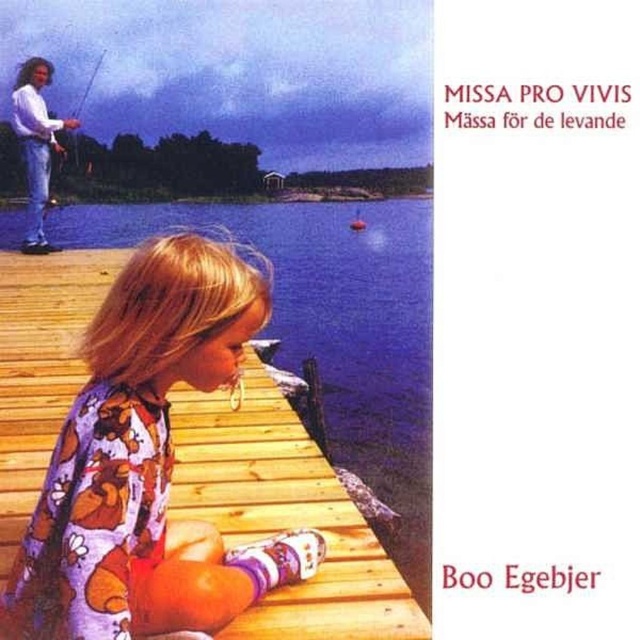
Question: Is purple printed dress at center positioned before matte white fishing pole at upper left?

Choices:
 (A) yes
 (B) no

Answer: (A)

Question: Which point is closer to the camera?

Choices:
 (A) white matte shirt at upper left
 (B) matte white fishing pole at upper left

Answer: (A)

Question: Based on their relative distances, which object is nearer to the matte white fishing pole at upper left?

Choices:
 (A) white matte shirt at upper left
 (B) purple printed dress at center

Answer: (A)

Question: Can you confirm if white matte shirt at upper left is positioned below matte white fishing pole at upper left?

Choices:
 (A) yes
 (B) no

Answer: (B)

Question: Which of these objects is positioned farthest from the white matte shirt at upper left?

Choices:
 (A) matte white fishing pole at upper left
 (B) purple printed dress at center

Answer: (B)

Question: Does white matte shirt at upper left have a smaller size compared to matte white fishing pole at upper left?

Choices:
 (A) yes
 (B) no

Answer: (B)